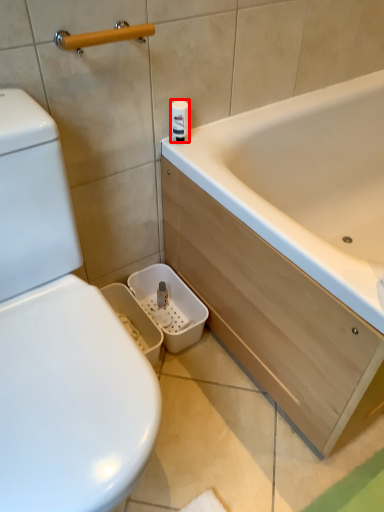
Question: From the image's perspective, where is toilet paper (annotated by the red box) located relative to towel bar?

Choices:
 (A) below
 (B) above

Answer: (A)